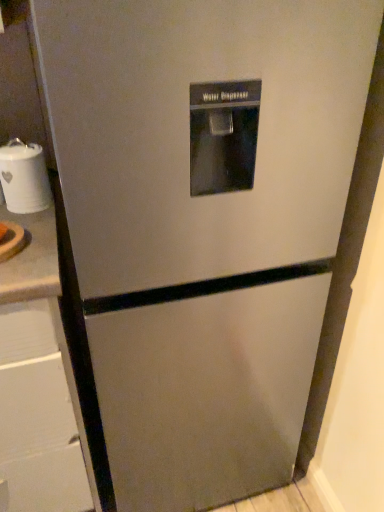
What is the approximate height of white ceramic jar at left?

white ceramic jar at left is 5.83 inches in height.

You are a GUI agent. You are given a task and a screenshot of the screen. Output one action in this format:
    pyautogui.click(x=<x>, y=<y>)
    Task: Click on the white ceramic jar at left
    This screenshot has height=512, width=384.
    Given the screenshot: What is the action you would take?
    pyautogui.click(x=24, y=177)

This screenshot has height=512, width=384. What do you see at coordinates (24, 177) in the screenshot? I see `white ceramic jar at left` at bounding box center [24, 177].

Where is `brushed metal drawer at left`? brushed metal drawer at left is located at coordinates (38, 414).

Describe the element at coordinates (38, 414) in the screenshot. The height and width of the screenshot is (512, 384). I see `brushed metal drawer at left` at that location.

The image size is (384, 512). Find the location of `white ceramic jar at left`. white ceramic jar at left is located at coordinates (24, 177).

Visually, is brushed metal drawer at left positioned to the left or to the right of white ceramic jar at left?

Clearly, brushed metal drawer at left is on the left of white ceramic jar at left in the image.

Between brushed metal drawer at left and white ceramic jar at left, which one is positioned in front?

brushed metal drawer at left is closer to the camera.

Considering the positions of point (59, 386) and point (24, 188), is point (59, 386) closer or farther from the camera than point (24, 188)?

Point (59, 386) is closer to the camera than point (24, 188).

From the image's perspective, would you say brushed metal drawer at left is shown under white ceramic jar at left?

Correct, brushed metal drawer at left appears lower than white ceramic jar at left in the image.

From a real-world perspective, is brushed metal drawer at left positioned above or below white ceramic jar at left?

Clearly, from a real-world perspective, brushed metal drawer at left is below white ceramic jar at left.

Which of these two, brushed metal drawer at left or white ceramic jar at left, is wider?

brushed metal drawer at left.

Between brushed metal drawer at left and white ceramic jar at left, which one has more height?

With more height is brushed metal drawer at left.

Based on the photo, considering the sizes of objects brushed metal drawer at left and white ceramic jar at left in the image provided, who is bigger, brushed metal drawer at left or white ceramic jar at left?

brushed metal drawer at left.

Is brushed metal drawer at left inside the boundaries of white ceramic jar at left, or outside?

brushed metal drawer at left is spatially situated outside white ceramic jar at left.

Is brushed metal drawer at left next to white ceramic jar at left?

No, brushed metal drawer at left is not making contact with white ceramic jar at left.

Is white ceramic jar at left at the back of brushed metal drawer at left?

No, brushed metal drawer at left is not facing the opposite direction of white ceramic jar at left.

Where is `appliance above the brushed metal drawer at left (from a real-world perspective)`? The height and width of the screenshot is (512, 384). appliance above the brushed metal drawer at left (from a real-world perspective) is located at coordinates (24, 177).

Does white ceramic jar at left appear on the left side of brushed metal drawer at left?

In fact, white ceramic jar at left is to the right of brushed metal drawer at left.

Considering the relative positions of white ceramic jar at left and brushed metal drawer at left in the image provided, is white ceramic jar at left in front of brushed metal drawer at left?

That is False.

Which is less distant, (x=9, y=154) or (x=14, y=373)?

Point (x=9, y=154).

From the image's perspective, is white ceramic jar at left located beneath brushed metal drawer at left?

Incorrect, from the image's perspective, white ceramic jar at left is higher than brushed metal drawer at left.

Based on the photo, from a real-world perspective, is white ceramic jar at left above or below brushed metal drawer at left?

Clearly, from a real-world perspective, white ceramic jar at left is above brushed metal drawer at left.

Which of these two, white ceramic jar at left or brushed metal drawer at left, is wider?

brushed metal drawer at left.

Does white ceramic jar at left have a greater height compared to brushed metal drawer at left?

Incorrect, the height of white ceramic jar at left is not larger of that of brushed metal drawer at left.

Which of these two, white ceramic jar at left or brushed metal drawer at left, is bigger?

brushed metal drawer at left.

Is brushed metal drawer at left completely or partially inside white ceramic jar at left?

No, brushed metal drawer at left is not inside white ceramic jar at left.

Is white ceramic jar at left placed right next to brushed metal drawer at left?

white ceramic jar at left and brushed metal drawer at left are not in contact.

Is brushed metal drawer at left at the back of white ceramic jar at left?

white ceramic jar at left is not turned away from brushed metal drawer at left.

Identify the location of appliance on the right of brushed metal drawer at left. 24,177.

Locate an element on the screen. appliance on the right of brushed metal drawer at left is located at coordinates pos(24,177).

Locate an element on the screen. The width and height of the screenshot is (384, 512). appliance lying above the brushed metal drawer at left (from the image's perspective) is located at coordinates point(24,177).